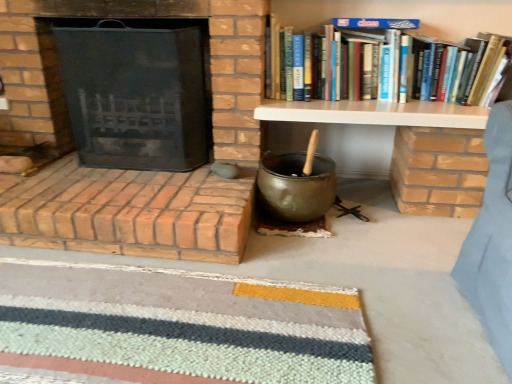
Question: Does brick fireplace at left, the 1th fireplace in the bottom-to-top sequence, appear on the left side of black mesh fireplace screen at left, the 1th fireplace in the top-to-bottom sequence?

Choices:
 (A) yes
 (B) no

Answer: (A)

Question: Would you say brick fireplace at left, the 1th fireplace in the bottom-to-top sequence, is outside black mesh fireplace screen at left, the second fireplace ordered from the bottom?

Choices:
 (A) yes
 (B) no

Answer: (A)

Question: Is brick fireplace at left, the 1th fireplace in the bottom-to-top sequence, positioned behind black mesh fireplace screen at left, the 1th fireplace in the top-to-bottom sequence?

Choices:
 (A) yes
 (B) no

Answer: (B)

Question: Is brick fireplace at left, acting as the second fireplace starting from the top, closer to camera compared to black mesh fireplace screen at left, the second fireplace ordered from the bottom?

Choices:
 (A) no
 (B) yes

Answer: (B)

Question: Would you consider brick fireplace at left, acting as the second fireplace starting from the top, to be distant from black mesh fireplace screen at left, the second fireplace ordered from the bottom?

Choices:
 (A) yes
 (B) no

Answer: (B)

Question: Considering the relative sizes of brick fireplace at left, acting as the second fireplace starting from the top, and black mesh fireplace screen at left, the 1th fireplace in the top-to-bottom sequence, in the image provided, is brick fireplace at left, acting as the second fireplace starting from the top, wider than black mesh fireplace screen at left, the 1th fireplace in the top-to-bottom sequence,?

Choices:
 (A) no
 (B) yes

Answer: (B)

Question: From a real-world perspective, is white wood shelf at upper right below striped wool doormat at lower center?

Choices:
 (A) no
 (B) yes

Answer: (A)

Question: Is white wood shelf at upper right to the left of striped wool doormat at lower center from the viewer's perspective?

Choices:
 (A) yes
 (B) no

Answer: (B)

Question: Is white wood shelf at upper right oriented towards striped wool doormat at lower center?

Choices:
 (A) yes
 (B) no

Answer: (B)

Question: From a real-world perspective, is white wood shelf at upper right physically above striped wool doormat at lower center?

Choices:
 (A) yes
 (B) no

Answer: (A)

Question: Is striped wool doormat at lower center inside white wood shelf at upper right?

Choices:
 (A) no
 (B) yes

Answer: (A)

Question: From the image's perspective, would you say white wood shelf at upper right is shown under striped wool doormat at lower center?

Choices:
 (A) yes
 (B) no

Answer: (B)

Question: From a real-world perspective, is striped wool doormat at lower center over brick fireplace at left, acting as the second fireplace starting from the top?

Choices:
 (A) no
 (B) yes

Answer: (A)